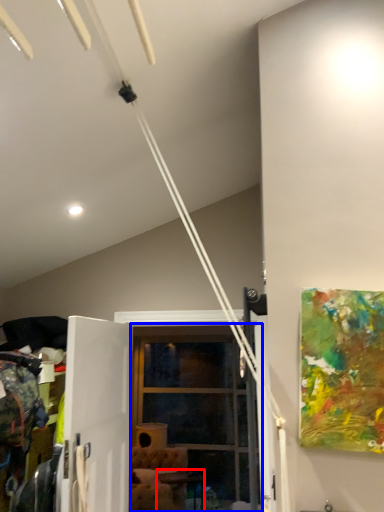
Question: Which object is further to the camera taking this photo, table (highlighted by a red box) or glass door (highlighted by a blue box)?

Choices:
 (A) table
 (B) glass door

Answer: (A)